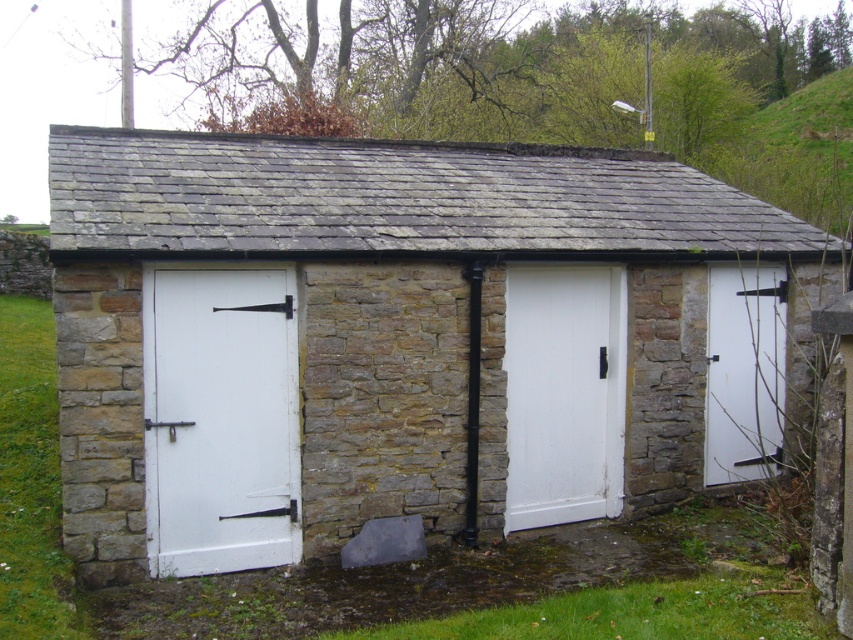
Which is more to the right, white painted wood door at center or white smooth door at center?

white smooth door at center is more to the right.

Which of these two, white painted wood door at center or white smooth door at center, stands taller?

white painted wood door at center is taller.

Is point (741, 200) positioned in front of point (590, 289)?

No, (741, 200) is further to viewer.

Identify the location of white painted wood door at center. (405, 339).

Does white painted wood door at center have a lesser width compared to white matte door at right?

In fact, white painted wood door at center might be wider than white matte door at right.

Is point (587, 237) positioned before point (755, 346)?

Yes.

Find the location of a particular element. white painted wood door at center is located at coordinates point(405,339).

The image size is (853, 640). Identify the location of white painted wood door at center. coord(405,339).

Between white smooth door at center and white matte door at right, which one appears on the right side from the viewer's perspective?

white matte door at right

Between white smooth door at center and white matte door at right, which one is positioned lower?

white smooth door at center is lower down.

Locate an element on the screen. The image size is (853, 640). white smooth door at center is located at coordinates (564, 394).